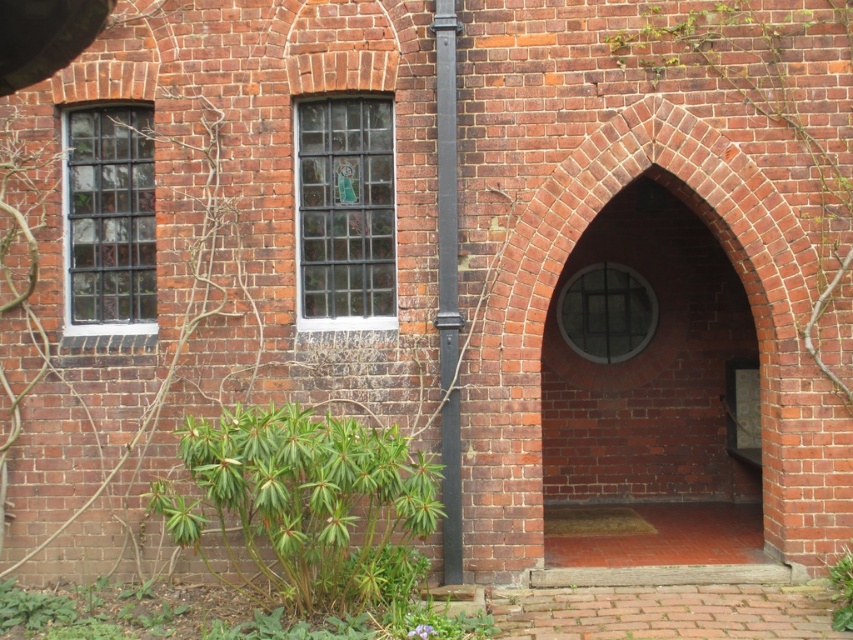
Which is more to the left, smooth brick archway at center or green leafy plant at center?

From the viewer's perspective, smooth brick archway at center appears more on the left side.

Image resolution: width=853 pixels, height=640 pixels. What are the coordinates of `smooth brick archway at center` in the screenshot? It's located at (653, 396).

Identify the location of smooth brick archway at center. (653, 396).

Consider the image. Does smooth black pole at center have a lesser height compared to green leafy plant at lower right?

No, smooth black pole at center is not shorter than green leafy plant at lower right.

Is smooth black pole at center closer to camera compared to green leafy plant at lower right?

No, it is behind green leafy plant at lower right.

Image resolution: width=853 pixels, height=640 pixels. In order to click on smooth black pole at center in this screenshot , I will do `click(448, 288)`.

Locate an element on the screen. smooth black pole at center is located at coordinates (448, 288).

In the scene shown: Can you confirm if smooth brick archway at center is positioned above green leafy plant at lower right?

Indeed, smooth brick archway at center is positioned over green leafy plant at lower right.

Who is shorter, smooth brick archway at center or green leafy plant at lower right?

green leafy plant at lower right is shorter.

Which is in front, point (666, 406) or point (845, 595)?

Point (845, 595) is in front.

Identify the location of smooth brick archway at center. This screenshot has height=640, width=853. (653, 396).